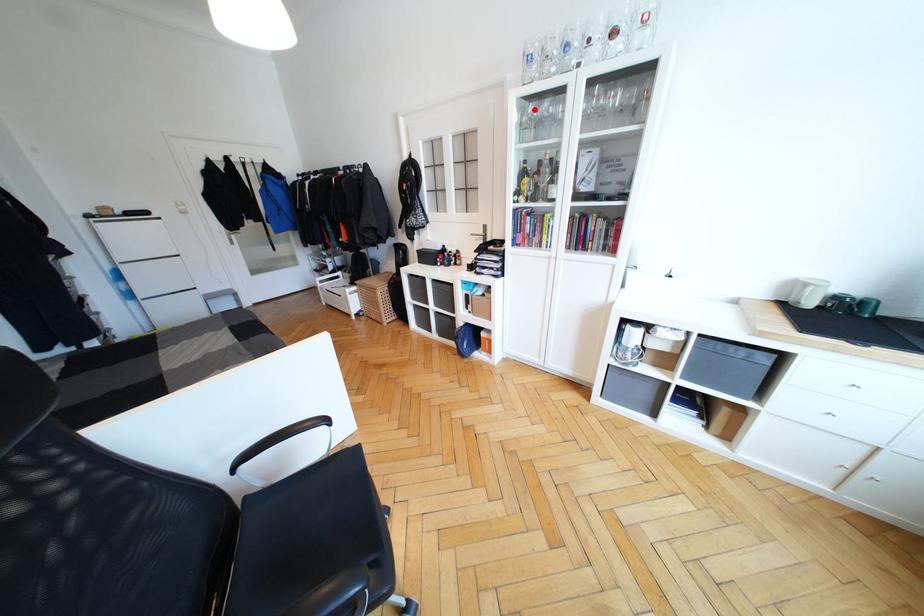
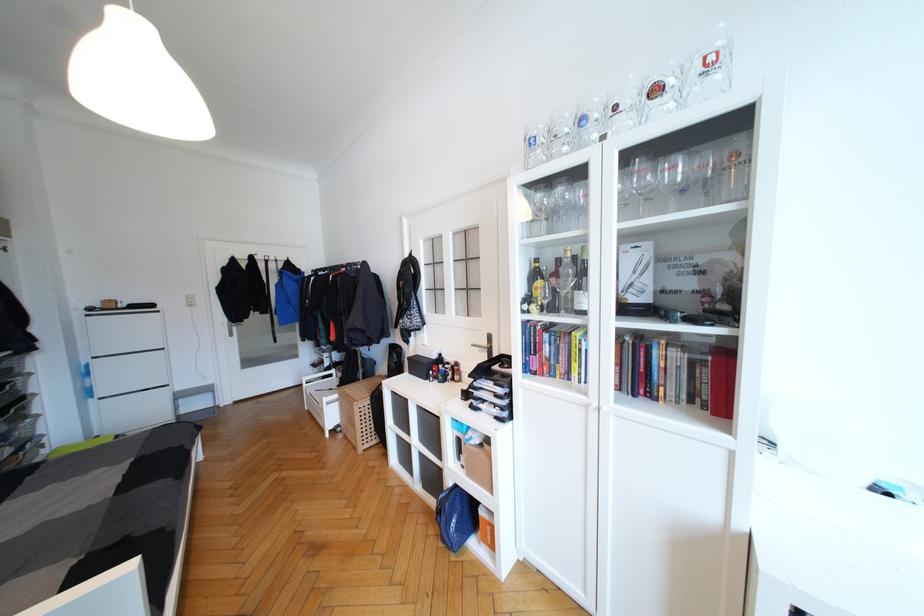
Find the pixel in the second image that matches the highlighted location in the first image.

(541, 197)